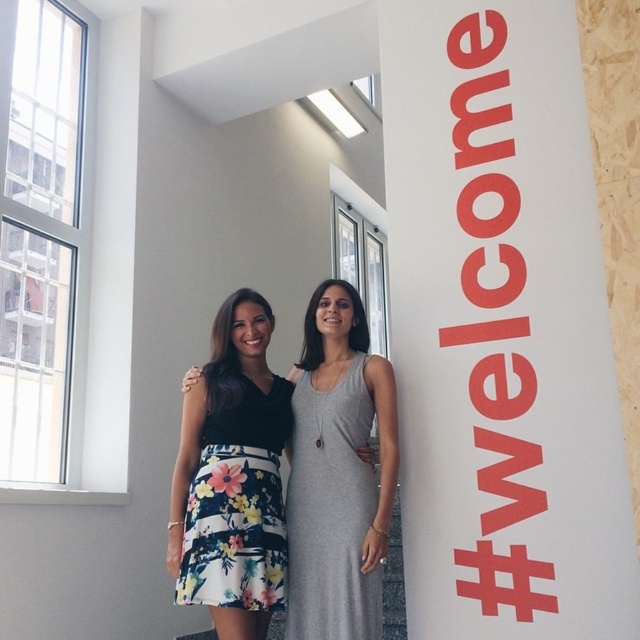
Question: Which point is farther to the camera?

Choices:
 (A) 426,470
 (B) 200,577
 (C) 364,381

Answer: (A)

Question: Which object is farther from the camera taking this photo?

Choices:
 (A) floral print skirt at center
 (B) gray matte dress at center
 (C) white smooth pillar at upper center
 (D) floral print fabric dress at center

Answer: (C)

Question: Does white smooth pillar at upper center come behind floral print fabric dress at center?

Choices:
 (A) yes
 (B) no

Answer: (A)

Question: Is white smooth pillar at upper center wider than gray matte dress at center?

Choices:
 (A) no
 (B) yes

Answer: (B)

Question: Among these objects, which one is farthest from the camera?

Choices:
 (A) floral print skirt at center
 (B) white smooth pillar at upper center
 (C) floral print fabric dress at center

Answer: (B)

Question: Is white smooth pillar at upper center bigger than floral print skirt at center?

Choices:
 (A) no
 (B) yes

Answer: (B)